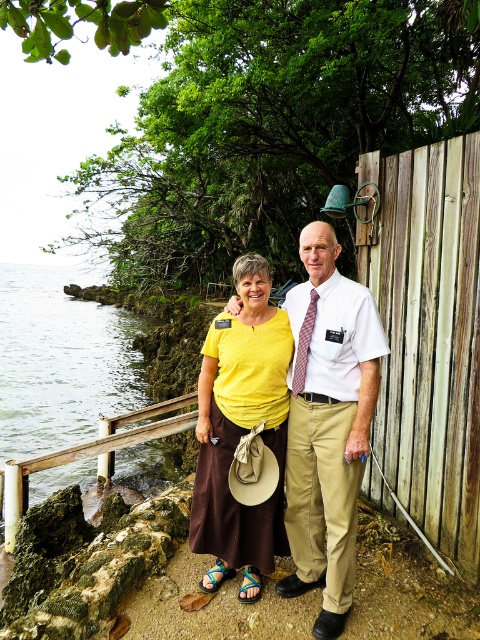
Question: Which of the following is the closest to the observer?

Choices:
 (A) (264, 294)
 (B) (362, 465)
 (C) (73, 337)
 (D) (442, 177)

Answer: (B)

Question: Among these points, which one is farthest from the camera?

Choices:
 (A) (86, 433)
 (B) (273, 317)

Answer: (A)

Question: Estimate the real-world distances between objects in this image. Which object is closer to the yellow matte shirt at center?

Choices:
 (A) yellow cotton shirt at center
 (B) weathered wood fence at right

Answer: (A)

Question: Is weathered wood fence at right to the left of clear water at lower left from the viewer's perspective?

Choices:
 (A) no
 (B) yes

Answer: (A)

Question: Does clear water at lower left have a lesser width compared to yellow matte shirt at center?

Choices:
 (A) yes
 (B) no

Answer: (B)

Question: Can you confirm if weathered wood fence at right is bigger than yellow matte shirt at center?

Choices:
 (A) yes
 (B) no

Answer: (A)